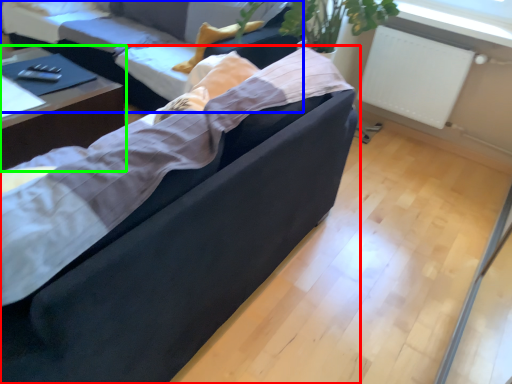
Question: Which is nearer to the studio couch (highlighted by a red box)? studio couch (highlighted by a blue box) or table (highlighted by a green box).

Choices:
 (A) studio couch
 (B) table

Answer: (B)